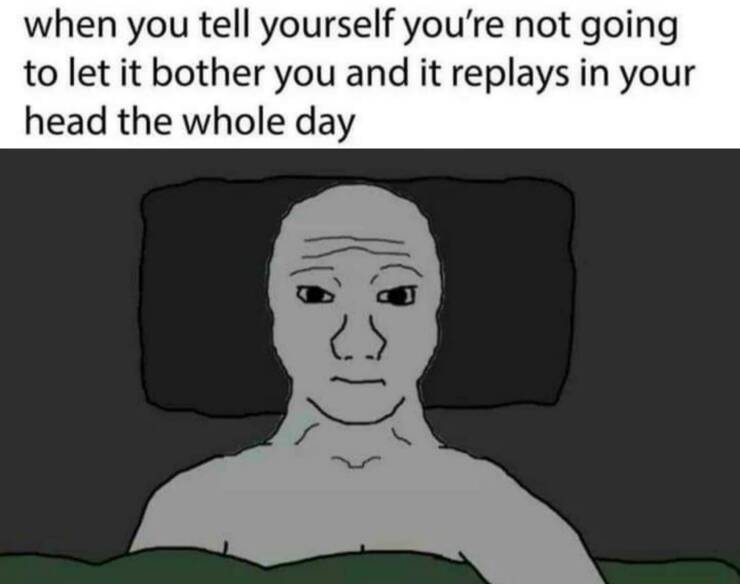
Where is `green blanket`? The width and height of the screenshot is (740, 584). green blanket is located at coordinates (407, 569).